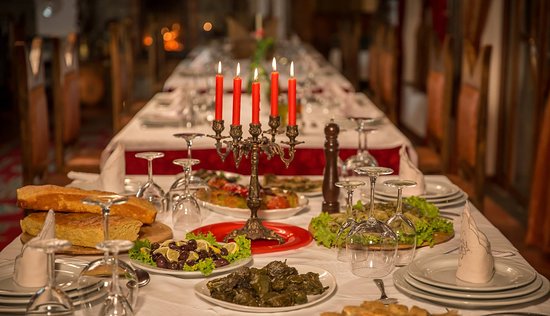
Find the location of a particular element. Image resolution: width=550 pixels, height=316 pixels. stacked plates is located at coordinates (445, 197).